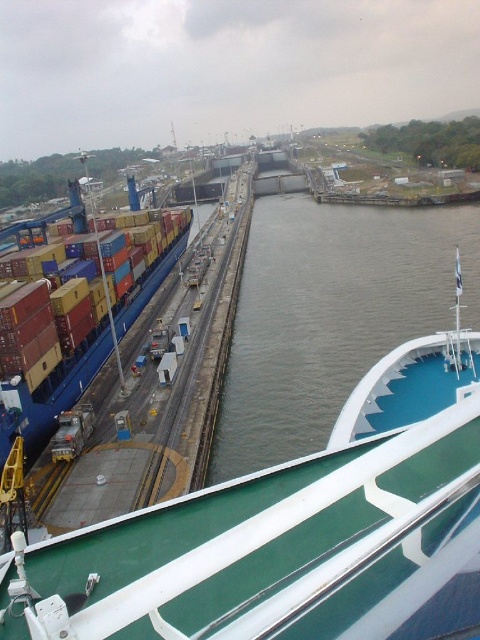
Question: Which point is closer to the camera?

Choices:
 (A) green smooth water at center
 (B) green matte boat at center

Answer: (B)

Question: Does green matte boat at center have a smaller size compared to green smooth water at center?

Choices:
 (A) yes
 (B) no

Answer: (A)

Question: Does green matte boat at center come behind green smooth water at center?

Choices:
 (A) yes
 (B) no

Answer: (B)

Question: Which of the following is the closest to the observer?

Choices:
 (A) (376, 508)
 (B) (352, 294)

Answer: (A)

Question: Is green matte boat at center wider than green smooth water at center?

Choices:
 (A) no
 (B) yes

Answer: (A)

Question: Which point is farther from the camera taking this photo?

Choices:
 (A) pos(251,241)
 (B) pos(321,560)

Answer: (A)